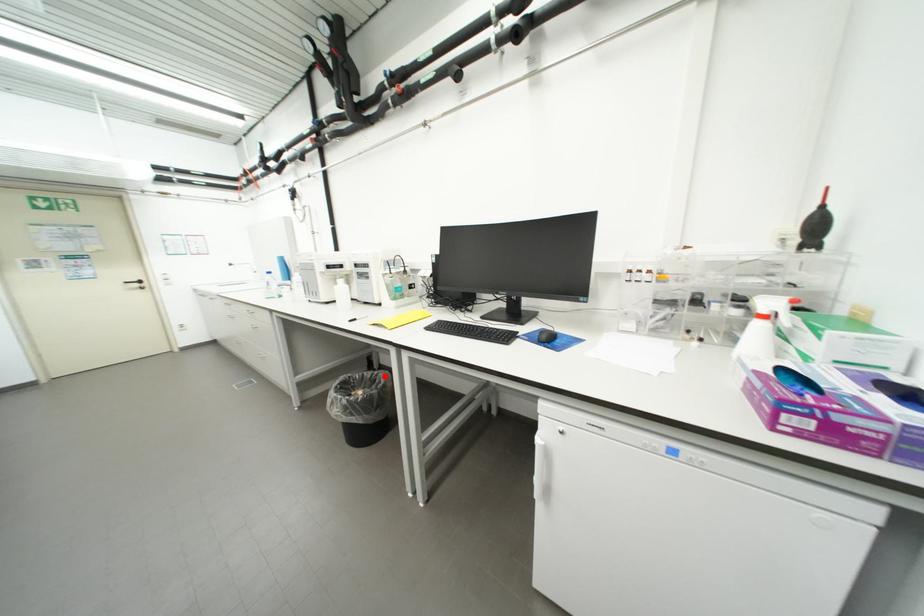
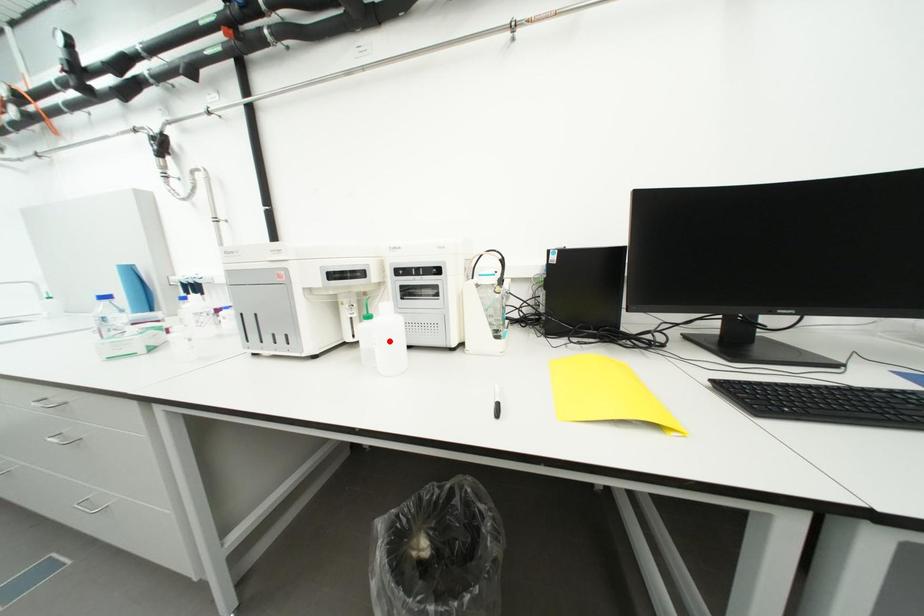
I am providing you with two images of the same scene from different viewpoints. A red point is marked on the first image and another point is marked on the second image. Is the red point in image1 aligned with the point shown in image2?

No